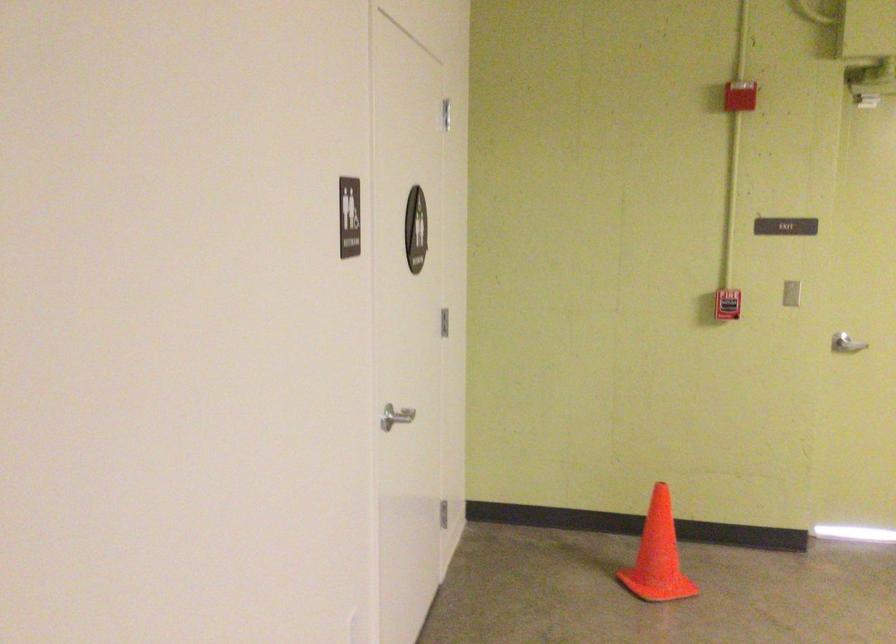
Locate an element on the screen. This screenshot has width=896, height=644. light switch is located at coordinates (790, 292).